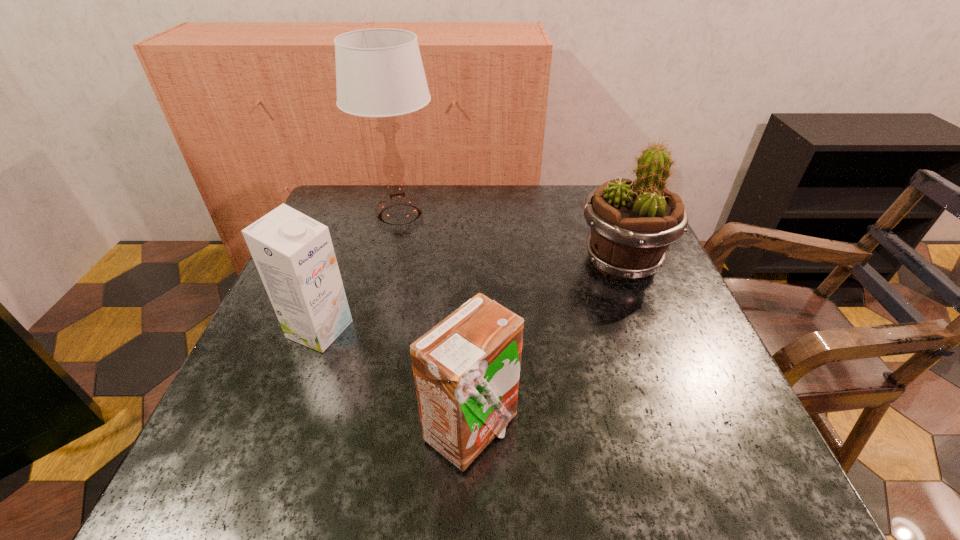
Locate an element on the screen. This screenshot has height=540, width=960. vacant area at the far left corner of the desktop is located at coordinates (322, 221).

Identify the location of vacant space at the near left corner. The image size is (960, 540). (284, 463).

You are a GUI agent. You are given a task and a screenshot of the screen. Output one action in this format:
    pyautogui.click(x=<x>, y=<y>)
    Task: Click on the empty space that is in between the third farthest object and the flowerpot
    This screenshot has height=540, width=960.
    Given the screenshot: What is the action you would take?
    470,295

The height and width of the screenshot is (540, 960). In order to click on vacant region between the flowerpot and the tallest object in this screenshot , I will do point(511,238).

Locate an element on the screen. The width and height of the screenshot is (960, 540). free space between the farther carton and the rightmost object is located at coordinates (470, 295).

Where is `empty space that is in between the table lamp and the second nearest object`? The width and height of the screenshot is (960, 540). empty space that is in between the table lamp and the second nearest object is located at coordinates (360, 272).

Where is `free spot between the flowerpot and the table lamp`? The width and height of the screenshot is (960, 540). free spot between the flowerpot and the table lamp is located at coordinates (511, 238).

Locate an element on the screen. This screenshot has height=540, width=960. empty space that is in between the nearest object and the farther carton is located at coordinates (396, 380).

At what (x,y) coordinates should I click in order to perform the action: click on vacant space in between the farther carton and the table lamp. Please return your answer as a coordinate pair (x, y). Looking at the image, I should click on (360, 272).

Where is `free space that is in between the second nearest object and the table lamp`? This screenshot has width=960, height=540. free space that is in between the second nearest object and the table lamp is located at coordinates (360, 272).